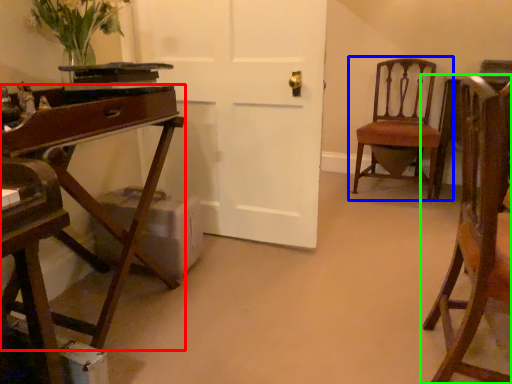
Question: Based on their relative distances, which object is farther from desk (highlighted by a red box)? Choose from chair (highlighted by a blue box) and chair (highlighted by a green box).

Choices:
 (A) chair
 (B) chair

Answer: (A)